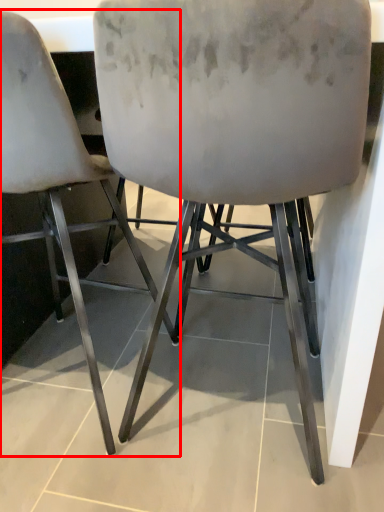
Question: In this image, where is chair (annotated by the red box) located relative to chair?

Choices:
 (A) left
 (B) right

Answer: (A)